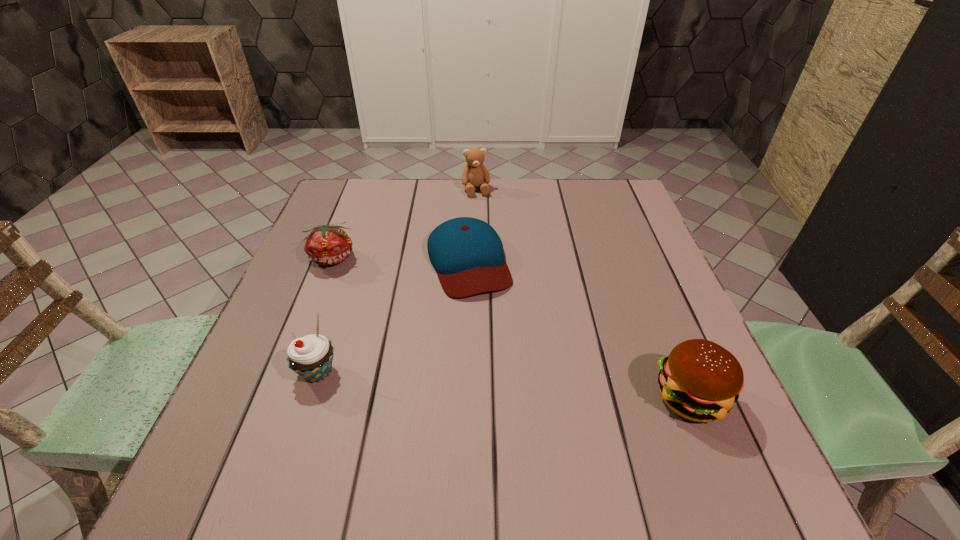
The width and height of the screenshot is (960, 540). I want to click on object located in the right edge section of the desktop, so click(x=700, y=380).

Identify the location of object present at the near right corner. (700, 380).

In the image, there is a desktop. Where is `free region at the far edge`? Image resolution: width=960 pixels, height=540 pixels. free region at the far edge is located at coordinates (507, 184).

In the image, there is a desktop. What are the coordinates of `free region at the near edge` in the screenshot? It's located at (363, 416).

Image resolution: width=960 pixels, height=540 pixels. I want to click on free space at the left edge of the desktop, so click(306, 301).

The height and width of the screenshot is (540, 960). In the image, there is a desktop. In order to click on vacant space at the right edge in this screenshot , I will do `click(675, 304)`.

I want to click on vacant region at the far left corner, so click(x=354, y=205).

The image size is (960, 540). In the image, there is a desktop. Identify the location of vacant space at the far right corner. (626, 197).

What are the coordinates of `empty space between the cupcake and the baseball cap` in the screenshot? It's located at (393, 316).

Identify the location of empty space that is in between the baseball cap and the tomato. The width and height of the screenshot is (960, 540). (400, 260).